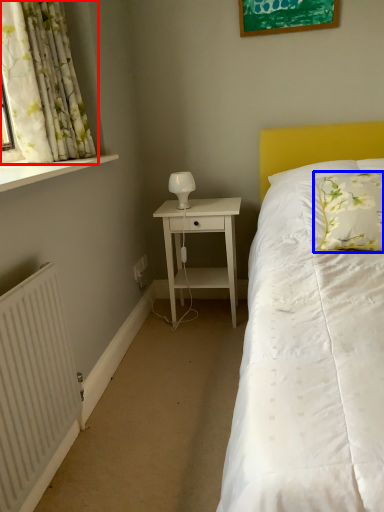
Question: Which object is closer to the camera taking this photo, curtain (highlighted by a red box) or pillow (highlighted by a blue box)?

Choices:
 (A) curtain
 (B) pillow

Answer: (A)